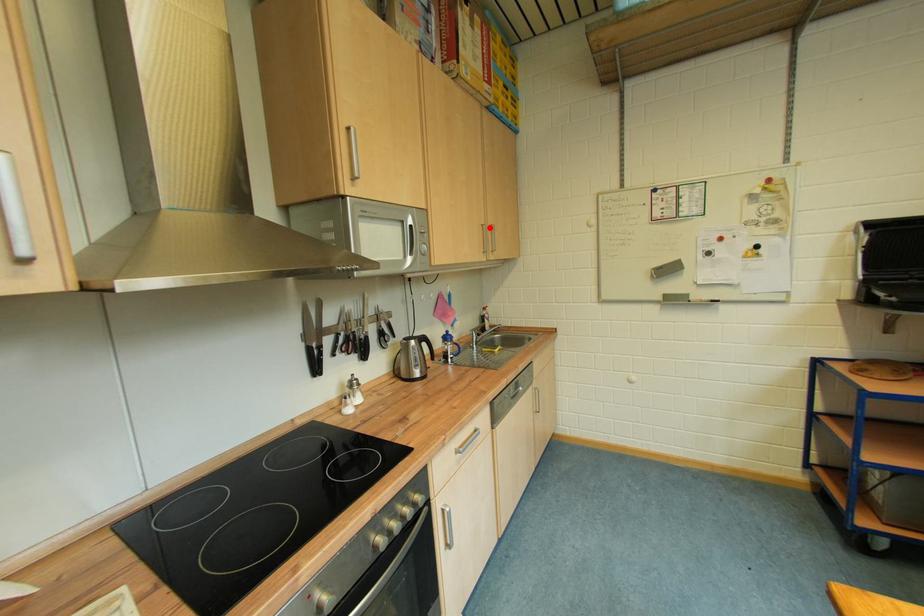
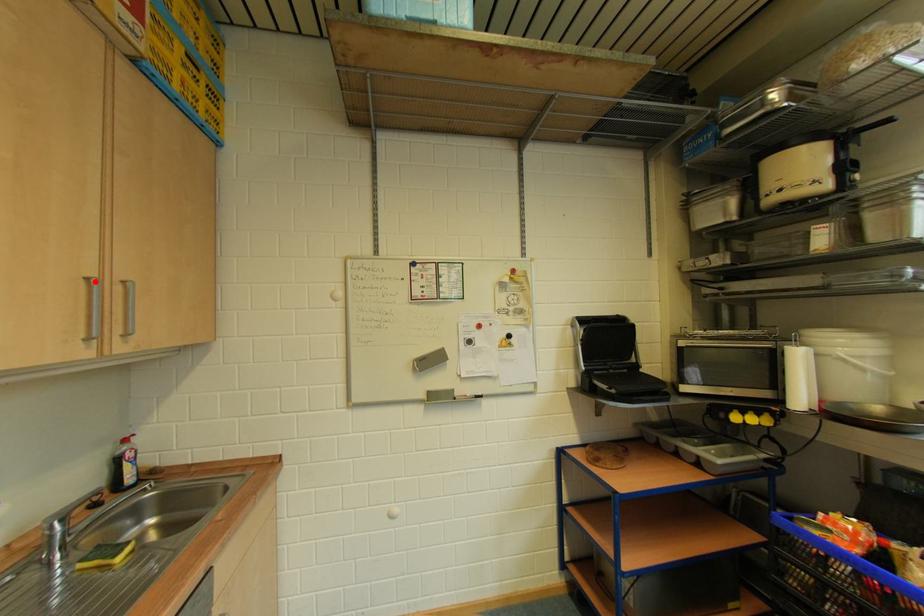
I am providing you with two images of the same scene from different viewpoints. A red point is marked on the first image and another point is marked on the second image. Is the red point in image1 aligned with the point shown in image2?

Yes